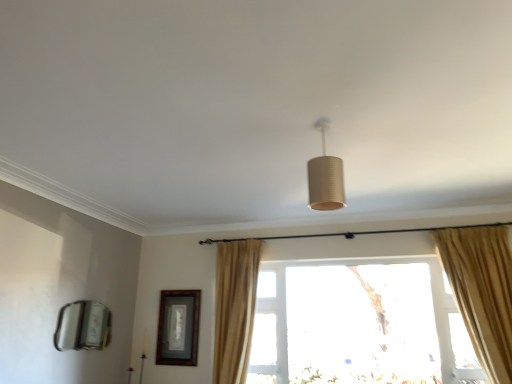
Question: Which is correct: transparent glass window at center is inside wooden framed picture at center left, or outside of it?

Choices:
 (A) inside
 (B) outside

Answer: (B)

Question: Based on their sizes in the image, would you say transparent glass window at center is bigger or smaller than wooden framed picture at center left?

Choices:
 (A) big
 (B) small

Answer: (A)

Question: Considering the real-world distances, which object is closest to the beige fabric curtain at center?

Choices:
 (A) transparent glass window at center
 (B) matte cardboard lampshade at center
 (C) wooden framed picture at center left

Answer: (A)

Question: Estimate the real-world distances between objects in this image. Which object is farther from the wooden framed picture at center left?

Choices:
 (A) transparent glass window at center
 (B) matte cardboard lampshade at center
 (C) beige fabric curtain at center

Answer: (B)